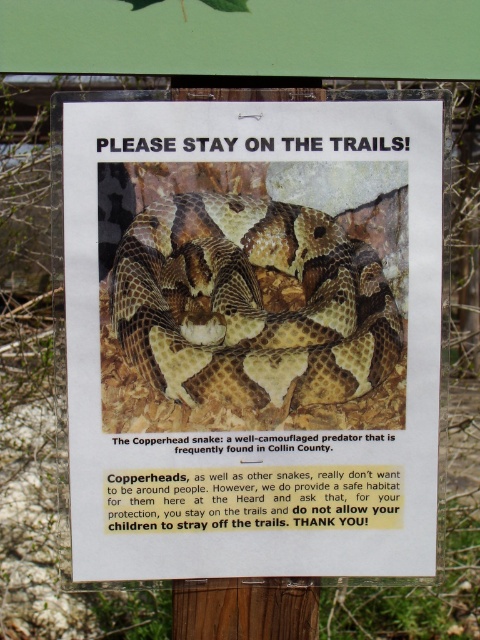
Does camouflage-patterned snake at center have a lesser width compared to camouflage scales snake at center?

No, camouflage-patterned snake at center is not thinner than camouflage scales snake at center.

Measure the distance between camouflage-patterned snake at center and camera.

They are 3.72 feet apart.

What do you see at coordinates (252, 337) in the screenshot? I see `camouflage-patterned snake at center` at bounding box center [252, 337].

Locate an element on the screen. The image size is (480, 640). camouflage-patterned snake at center is located at coordinates (252, 337).